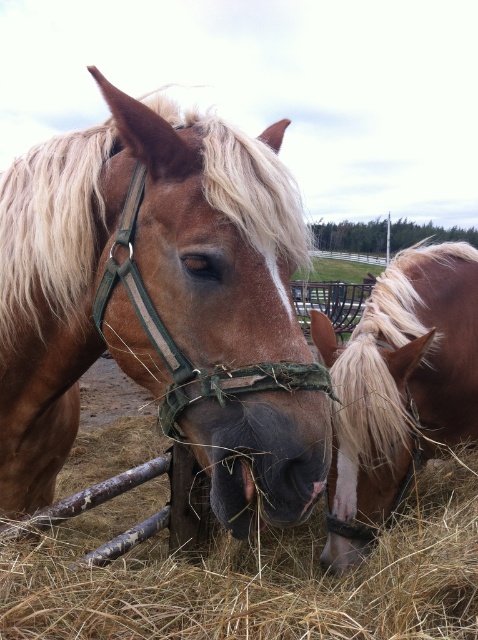
Question: Based on their relative distances, which object is nearer to the blonde mane horse at right?

Choices:
 (A) brown dry hay at center
 (B) brown matte horse at center

Answer: (A)

Question: From the image, what is the correct spatial relationship of brown matte horse at center in relation to brown dry hay at center?

Choices:
 (A) above
 (B) below

Answer: (A)

Question: Can you confirm if brown matte horse at center is positioned to the right of blonde mane horse at right?

Choices:
 (A) no
 (B) yes

Answer: (A)

Question: Can you confirm if brown matte horse at center is positioned to the left of blonde mane horse at right?

Choices:
 (A) yes
 (B) no

Answer: (A)

Question: Among these objects, which one is nearest to the camera?

Choices:
 (A) brown matte horse at center
 (B) blonde mane horse at right

Answer: (A)

Question: Among these objects, which one is nearest to the camera?

Choices:
 (A) blonde mane horse at right
 (B) brown dry hay at center

Answer: (B)